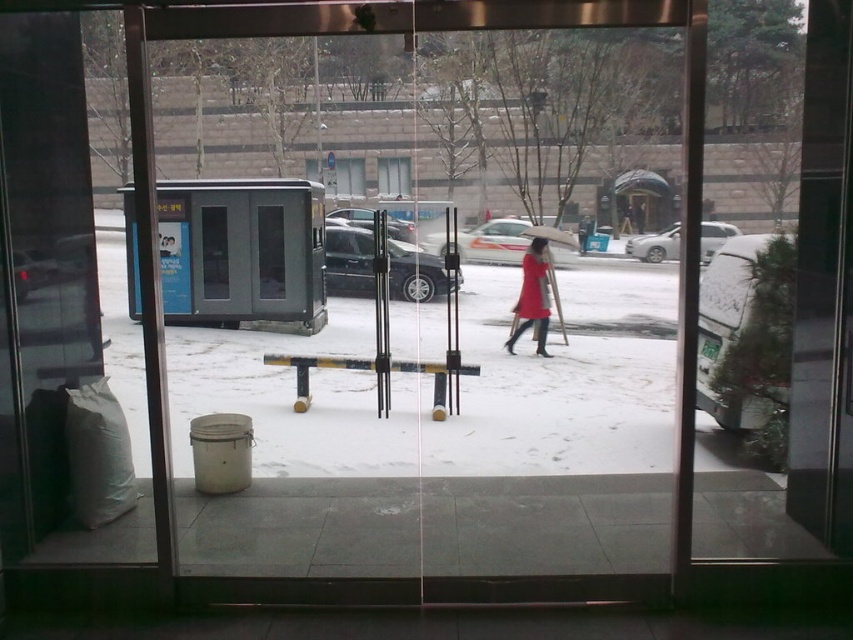
Is matte red coat at center further to camera compared to clear glass window at center?

No, matte red coat at center is in front of clear glass window at center.

Which is behind, point (524, 291) or point (397, 195)?

The point (397, 195) is more distant.

Between point (508, 339) and point (390, 157), which one is positioned in front?

Point (508, 339) is in front.

You are a GUI agent. You are given a task and a screenshot of the screen. Output one action in this format:
    pyautogui.click(x=<x>, y=<y>)
    Task: Click on the matte red coat at center
    This screenshot has width=853, height=640.
    Given the screenshot: What is the action you would take?
    pyautogui.click(x=532, y=298)

Measure the distance between point (x=381, y=189) and camera.

9.71 meters

Which is in front, point (404, 196) or point (572, 244)?

Positioned in front is point (572, 244).

Locate an element on the screen. The height and width of the screenshot is (640, 853). clear glass window at center is located at coordinates (393, 177).

Is matte red coat at center to the left of brown fabric umbrella at center from the viewer's perspective?

Yes, matte red coat at center is to the left of brown fabric umbrella at center.

Between point (537, 285) and point (550, 227), which one is positioned behind?

Point (550, 227)

Find the location of `matte red coat at center`. matte red coat at center is located at coordinates (532, 298).